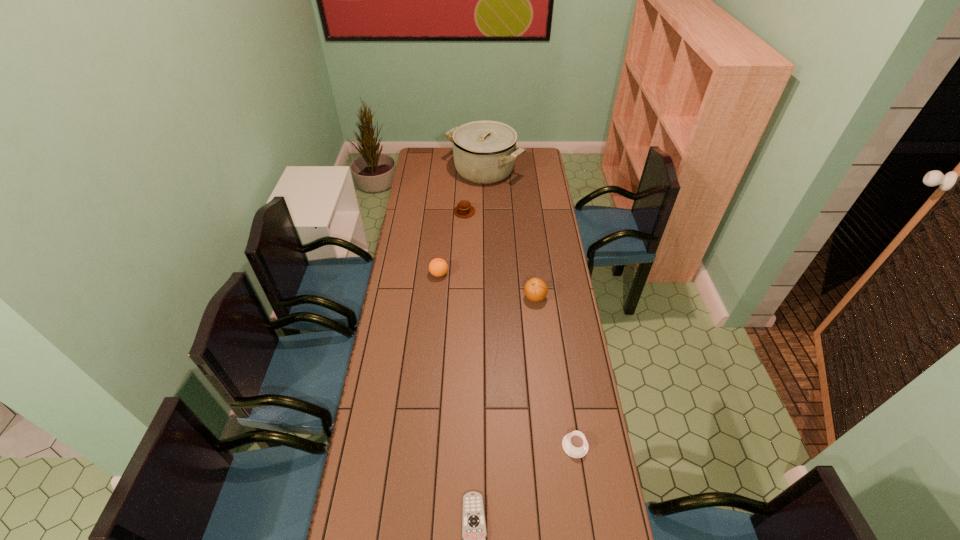
At what (x,y) coordinates should I click in order to perform the action: click on vacant area situated 0.100m on the front of the saucepan. Please return your answer as a coordinate pair (x, y). The image size is (960, 540). Looking at the image, I should click on (485, 199).

Where is `free space located on the left of the taller orange`? free space located on the left of the taller orange is located at coordinates (509, 298).

Where is `vacant region located on the right of the farther orange`? vacant region located on the right of the farther orange is located at coordinates (522, 274).

Locate an element on the screen. vacant position located on the back of the fourth tallest object is located at coordinates (467, 167).

Identify the location of free location located 0.310m on the handle side of the fifth farthest object. (562, 354).

The height and width of the screenshot is (540, 960). What are the coordinates of `free space located 0.310m on the handle side of the fifth farthest object` in the screenshot? It's located at (562, 354).

Where is `vacant region located 0.250m on the handle side of the fifth farthest object`? The width and height of the screenshot is (960, 540). vacant region located 0.250m on the handle side of the fifth farthest object is located at coordinates (564, 367).

Locate an element on the screen. object located at the far edge is located at coordinates (484, 152).

Locate an element on the screen. Image resolution: width=960 pixels, height=540 pixels. object that is at the left edge is located at coordinates (438, 267).

You are a GUI agent. You are given a task and a screenshot of the screen. Output one action in this format:
    pyautogui.click(x=<x>, y=<y>)
    Task: Click on the saucepan present at the right edge
    This screenshot has height=540, width=960.
    Given the screenshot: What is the action you would take?
    pyautogui.click(x=484, y=152)